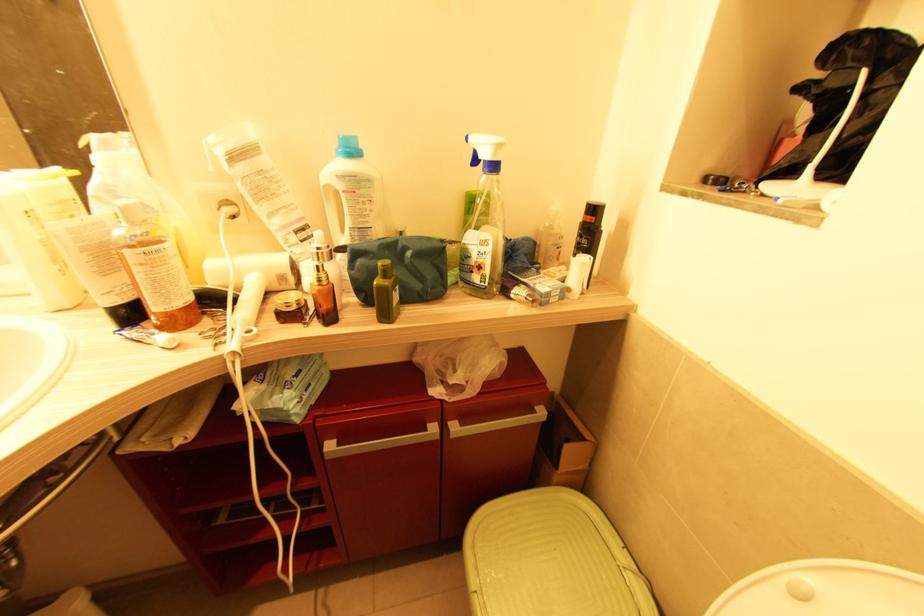
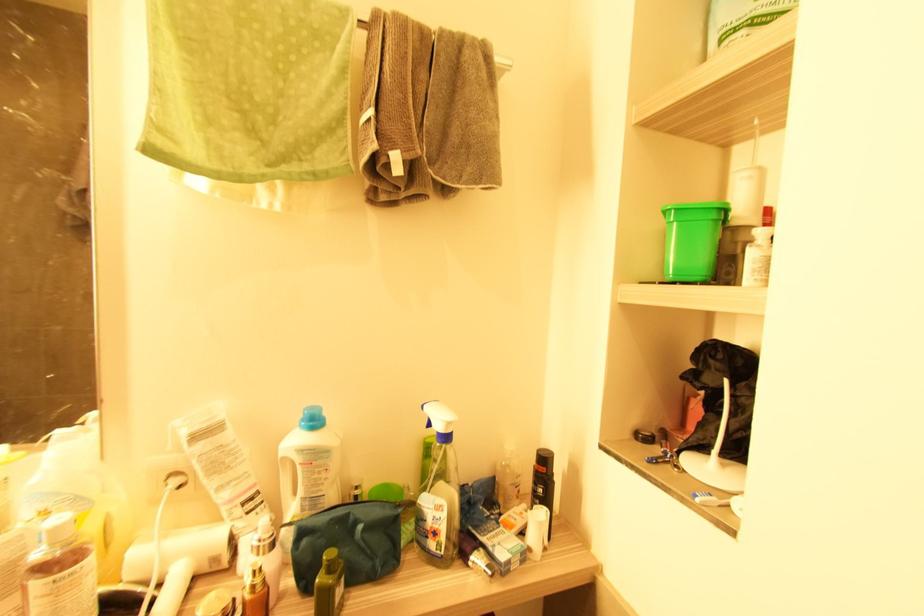
In the second image, find the point that corresponds to point (284, 278) in the first image.

(216, 561)